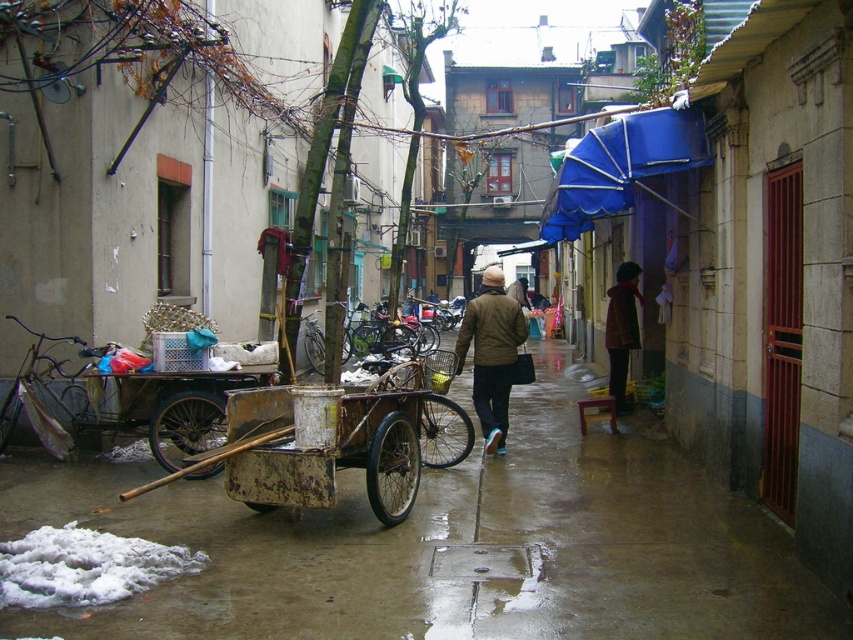
Does rusty metal tricycle at left appear on the right side of brown woolen coat at right?

In fact, rusty metal tricycle at left is to the left of brown woolen coat at right.

Can you confirm if rusty metal tricycle at left is taller than brown woolen coat at right?

Incorrect, rusty metal tricycle at left's height is not larger of brown woolen coat at right's.

Locate an element on the screen. This screenshot has width=853, height=640. rusty metal tricycle at left is located at coordinates (49, 385).

At what (x,y) coordinates should I click in order to perform the action: click on rusty metal tricycle at left. Please return your answer as a coordinate pair (x, y). Looking at the image, I should click on (49, 385).

Between blue fabric umbrella at upper center and brown woolen coat at right, which one is positioned higher?

blue fabric umbrella at upper center is higher up.

Who is more distant from viewer, (641, 156) or (622, 273)?

The point (622, 273) is behind.

You are a GUI agent. You are given a task and a screenshot of the screen. Output one action in this format:
    pyautogui.click(x=<x>, y=<y>)
    Task: Click on the blue fabric umbrella at upper center
    
    Given the screenshot: What is the action you would take?
    pyautogui.click(x=619, y=166)

Looking at this image, is wet concrete pavement at lower left to the right of brown matte jacket at center from the viewer's perspective?

In fact, wet concrete pavement at lower left is to the left of brown matte jacket at center.

Can you confirm if wet concrete pavement at lower left is bigger than brown matte jacket at center?

Correct, wet concrete pavement at lower left is larger in size than brown matte jacket at center.

Between point (746, 595) and point (457, 336), which one is positioned in front?

Point (746, 595)

I want to click on wet concrete pavement at lower left, so click(447, 545).